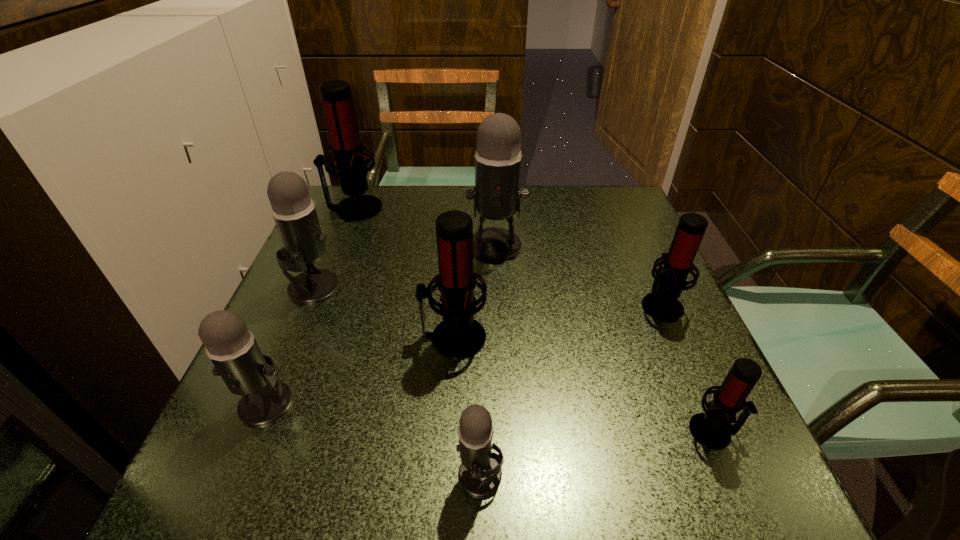
Identify the location of the nearest gray microphone. (480, 474).

This screenshot has width=960, height=540. I want to click on free spot located on the right of the biggest red microphone, so click(531, 208).

Locate an element on the screen. The image size is (960, 540). blank space located on the left of the biggest gray microphone is located at coordinates (400, 245).

You are a GUI agent. You are given a task and a screenshot of the screen. Output one action in this format:
    pyautogui.click(x=<x>, y=<y>)
    Task: Click on the free location located on the back of the second biggest gray microphone
    
    Given the screenshot: What is the action you would take?
    pyautogui.click(x=348, y=204)

The image size is (960, 540). Identify the location of vacant space located 0.110m on the right of the second red microphone from left to right. (543, 338).

The height and width of the screenshot is (540, 960). In order to click on vacant space positioned on the left of the third biggest red microphone in this screenshot , I will do `click(491, 304)`.

Locate an element on the screen. The height and width of the screenshot is (540, 960). blank space located on the front of the third biggest gray microphone is located at coordinates (227, 498).

The height and width of the screenshot is (540, 960). Find the location of `vacant area located 0.200m on the left of the smallest red microphone`. vacant area located 0.200m on the left of the smallest red microphone is located at coordinates tap(564, 431).

What are the coordinates of `vacant region located 0.350m on the left of the nearest gray microphone` in the screenshot? It's located at (218, 475).

This screenshot has width=960, height=540. I want to click on object that is at the far left corner, so click(336, 95).